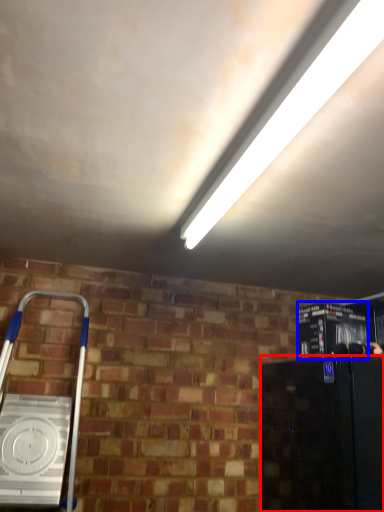
Question: Among these objects, which one is nearest to the camera, appliance (highlighted by a red box) or appliance (highlighted by a blue box)?

Choices:
 (A) appliance
 (B) appliance

Answer: (A)